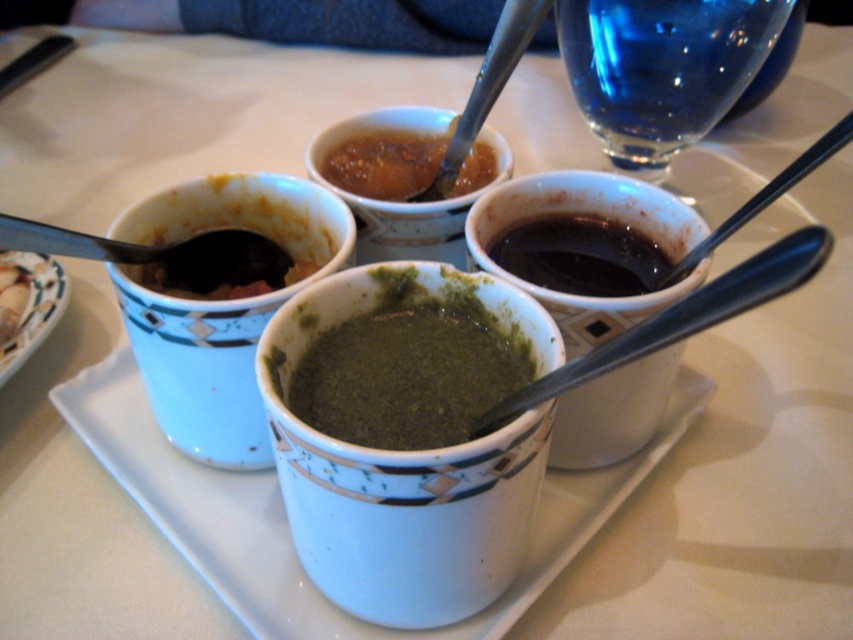
Does green matte soup at center have a larger size compared to shiny brown sauce at center?

Correct, green matte soup at center is larger in size than shiny brown sauce at center.

Is green matte soup at center to the left of shiny brown sauce at center from the viewer's perspective?

In fact, green matte soup at center is to the right of shiny brown sauce at center.

Is point (496, 342) positioned behind point (347, 164)?

No.

Image resolution: width=853 pixels, height=640 pixels. What are the coordinates of `green matte soup at center` in the screenshot? It's located at (409, 372).

Is green matte soup at center smaller than dark glossy sauce at upper right?

Incorrect, green matte soup at center is not smaller in size than dark glossy sauce at upper right.

Who is taller, green matte soup at center or dark glossy sauce at upper right?

Standing taller between the two is green matte soup at center.

Who is more distant from viewer, [426,336] or [618,289]?

The point [618,289] is behind.

The height and width of the screenshot is (640, 853). I want to click on green matte soup at center, so click(x=409, y=372).

Which is above, transparent glass at upper right or black plastic spoon at upper center?

transparent glass at upper right is higher up.

Is transparent glass at upper right above black plastic spoon at upper center?

Yes.

Describe the element at coordinates (660, 67) in the screenshot. I see `transparent glass at upper right` at that location.

The image size is (853, 640). In order to click on transparent glass at upper right in this screenshot , I will do `click(660, 67)`.